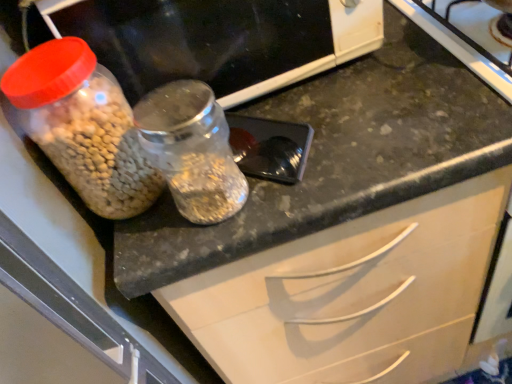
In order to click on vacant area that is situated to the right of metallic black spoon at center in this screenshot , I will do `click(377, 124)`.